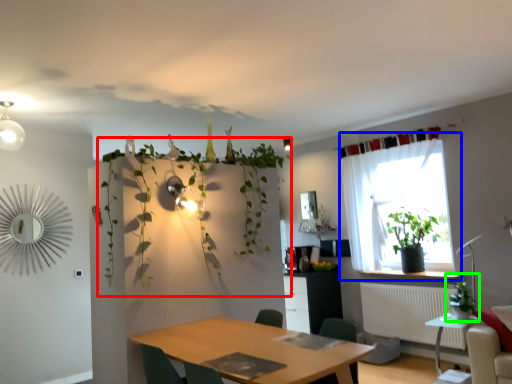
Question: Estimate the real-world distances between objects in this image. Which object is farther from vegetation (highlighted by a red box), window (highlighted by a blue box) or houseplant (highlighted by a green box)?

Choices:
 (A) window
 (B) houseplant

Answer: (B)